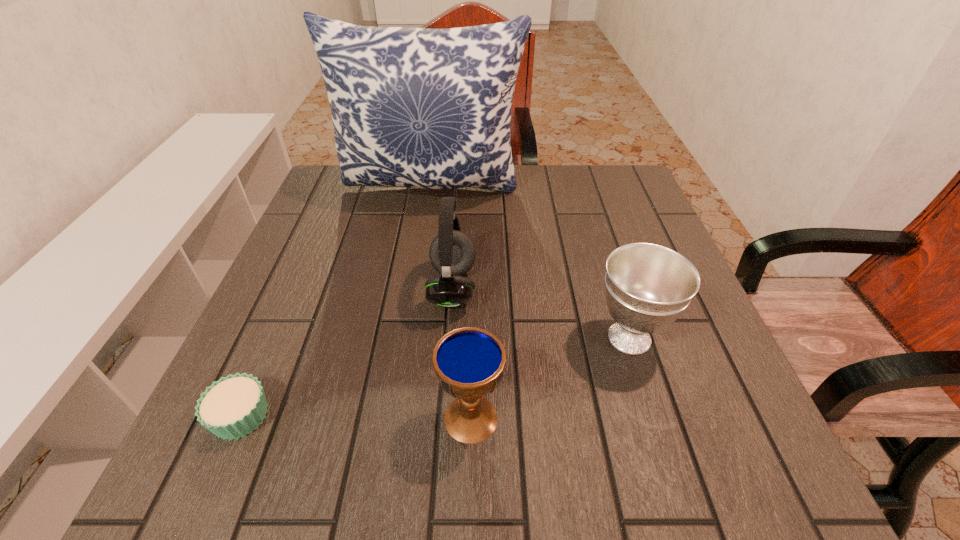
Find the location of `cushion`. cushion is located at coordinates (424, 108).

You are a GUI agent. You are given a task and a screenshot of the screen. Output one action in this format:
    pyautogui.click(x=<x>, y=<y>)
    Task: Click on the farthest object
    The width and height of the screenshot is (960, 540).
    Given the screenshot: What is the action you would take?
    pyautogui.click(x=424, y=108)

At what (x,y) coordinates should I click in order to perform the action: click on headset. Please return your answer as a coordinate pair (x, y). The width and height of the screenshot is (960, 540). Looking at the image, I should click on (452, 253).

At what (x,y) coordinates should I click in order to perform the action: click on the farther chalice. Please return your answer as a coordinate pair (x, y). Looking at the image, I should click on (647, 286).

You are a GUI agent. You are given a task and a screenshot of the screen. Output one action in this format:
    pyautogui.click(x=<x>, y=<y>)
    Task: Click on the rightmost object
    Image resolution: width=960 pixels, height=540 pixels.
    Given the screenshot: What is the action you would take?
    pyautogui.click(x=647, y=286)

Locate an element on the screen. the nearer chalice is located at coordinates (469, 362).

Locate an element on the screen. This screenshot has height=540, width=960. cupcake is located at coordinates (234, 406).

Locate an element on the screen. The width and height of the screenshot is (960, 540). free space located on the front surface of the tallest object is located at coordinates (422, 249).

Find the location of `free spot located 0.170m on the ear cups of the headset`. free spot located 0.170m on the ear cups of the headset is located at coordinates (559, 288).

You are a GUI agent. You are given a task and a screenshot of the screen. Output one action in this format:
    pyautogui.click(x=<x>, y=<y>)
    Task: Click on the free space located on the back of the right chalice
    The width and height of the screenshot is (960, 540).
    Given the screenshot: What is the action you would take?
    pyautogui.click(x=612, y=284)